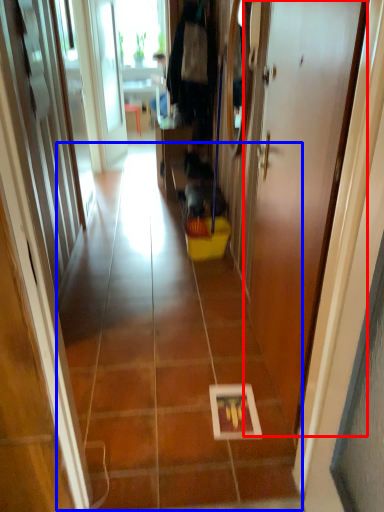
Question: Which point is further to the camera, door (highlighted by a red box) or path (highlighted by a blue box)?

Choices:
 (A) door
 (B) path

Answer: (B)